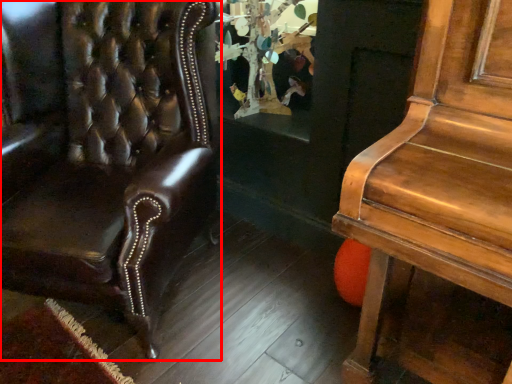
Question: From the image's perspective, where is chair (annotated by the red box) located in relation to shop window in the image?

Choices:
 (A) below
 (B) above

Answer: (A)